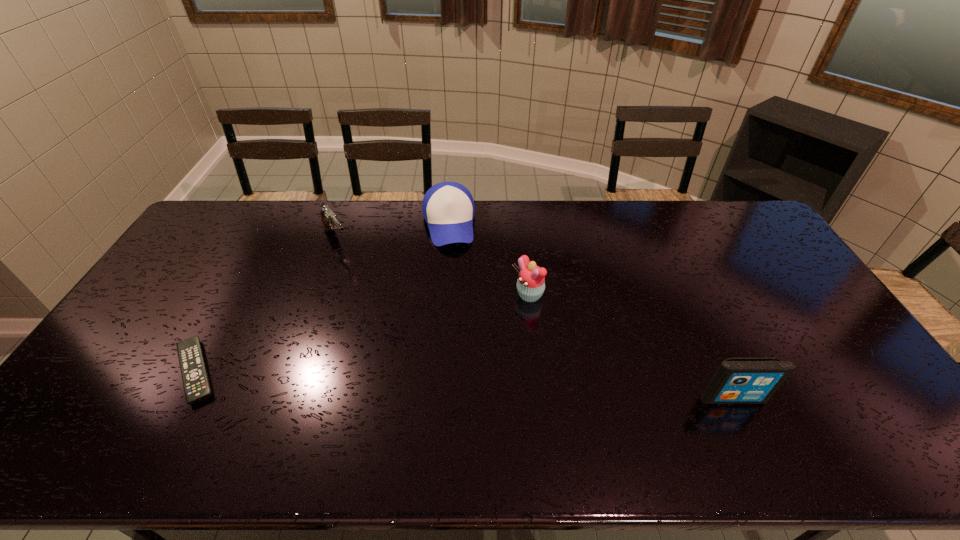
Locate an element on the screen. vacant space on the desktop that is between the remote control and the iPod and is positioned on the face of the third nearest object is located at coordinates click(x=387, y=381).

Locate an element on the screen. free space on the desktop that is between the remote control and the rightmost object and is positioned on the front-facing side of the baseball cap is located at coordinates (465, 385).

You are a GUI agent. You are given a task and a screenshot of the screen. Output one action in this format:
    pyautogui.click(x=<x>, y=<y>)
    Task: Click on the vacant space on the desktop that is between the leftmost object and the iPod and is positioned at the barrel of the pistol
    
    Given the screenshot: What is the action you would take?
    pyautogui.click(x=441, y=383)